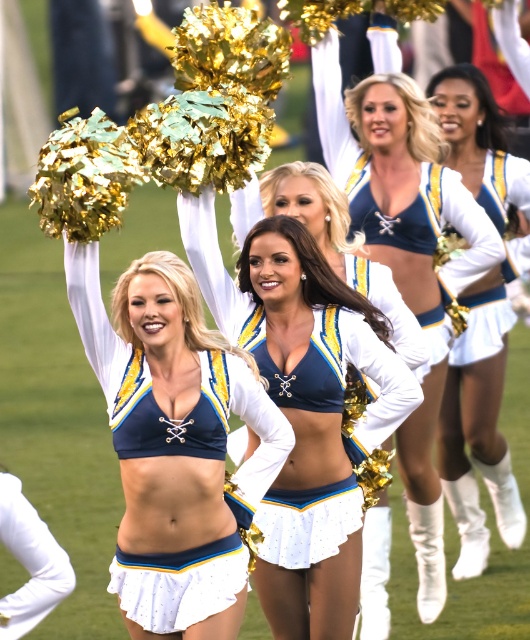
You are a photographer trying to capture the cheerleaders. You notice two blue tops at the center of the image. Which one is positioned lower between the matte blue bikini top at center and the matte blue fabric top at center?

The matte blue bikini top at center is located below the matte blue fabric top at center, so the matte blue bikini top at center is positioned lower.

You are a photographer trying to capture the cheerleaders. You notice the blue satin cheerleader at center and the white matte skirt at center. Which one appears wider in the photo?

The blue satin cheerleader at center appears wider than the white matte skirt at center because its width is larger.